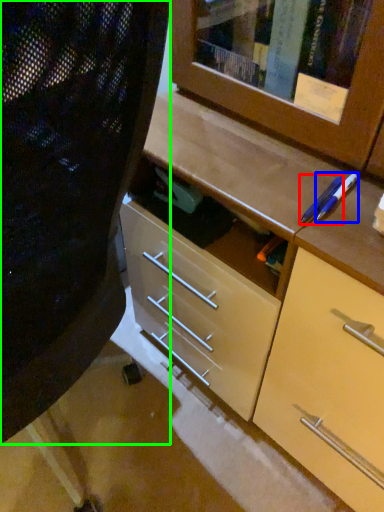
Question: Which is nearer to the pencil (highlighted by a red box)? pencil (highlighted by a blue box) or folding chair (highlighted by a green box).

Choices:
 (A) pencil
 (B) folding chair

Answer: (A)